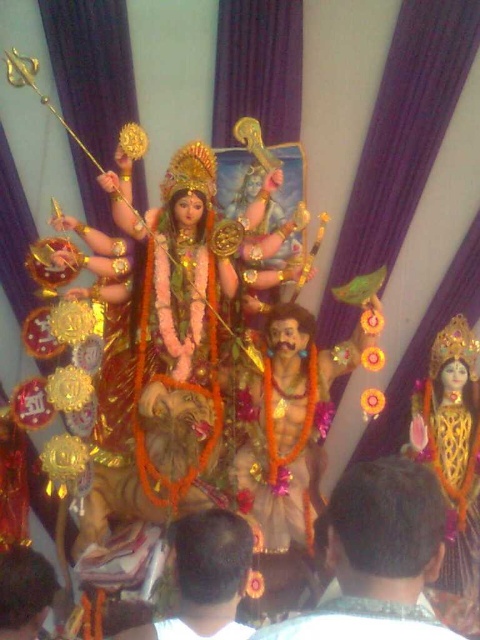
In the Hindu festival scene, there are two brown hair elements present. The first is the brown textured hair at center, and the second is the brown hair at lower center. From an observer standing in front of the image, which of these two hair elements appears taller?

The brown textured hair at center appears taller than the brown hair at lower center because it has a greater height compared to it according to the description.

You are an art student analyzing the image of the deity. You notice two hair elements, the brown textured hair at center and the dark brown hair at lower left. Which hair element is positioned closer to you?

The brown textured hair at center is closer to the viewer than the dark brown hair at lower left.

Looking at this image, in the scene of the Hindu festival, there are two brown hair elements present. The first is the brown textured hair at center, and the second is the brown hair at lower center. From an observer standing in front of the image, which of these two hair elements is positioned higher up?

The brown textured hair at center is positioned above the brown hair at lower center, so it is higher up.